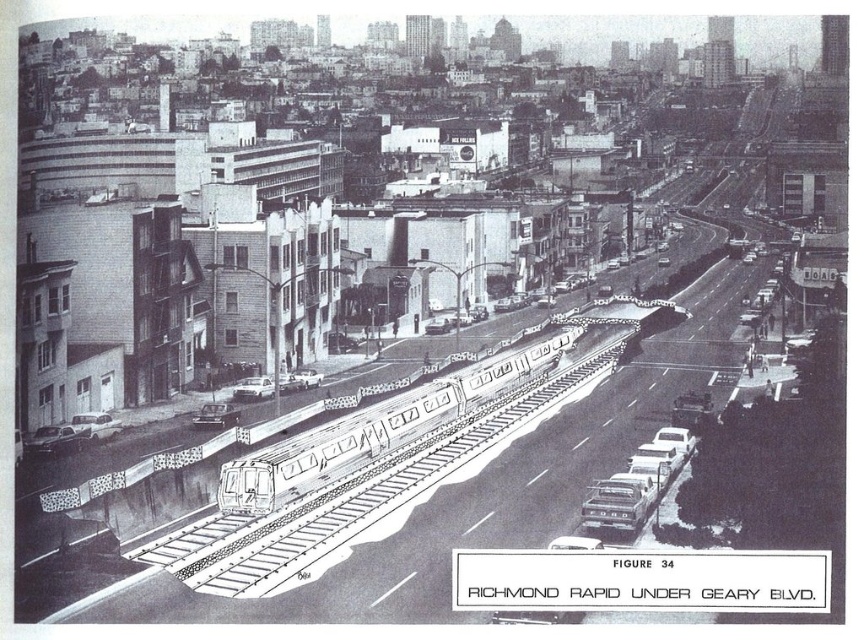
Question: Which of the following is the farthest from the observer?

Choices:
 (A) (205, 406)
 (B) (259, 388)

Answer: (B)

Question: Is smooth silver train at center above shiny silver sedan at center-left?

Choices:
 (A) yes
 (B) no

Answer: (A)

Question: Can you confirm if smooth silver train at center is positioned above white glossy sedan at center-right?

Choices:
 (A) yes
 (B) no

Answer: (A)

Question: Which object is the farthest from the smooth silver train at center?

Choices:
 (A) metallic silver car at center-left
 (B) white glossy sedan at center-right
 (C) shiny silver sedan at center-left

Answer: (A)

Question: Is smooth silver train at center closer to the viewer compared to white glossy sedan at center-right?

Choices:
 (A) yes
 (B) no

Answer: (B)

Question: Among these points, which one is farthest from the camera?

Choices:
 (A) (224, 426)
 (B) (353, 436)

Answer: (A)